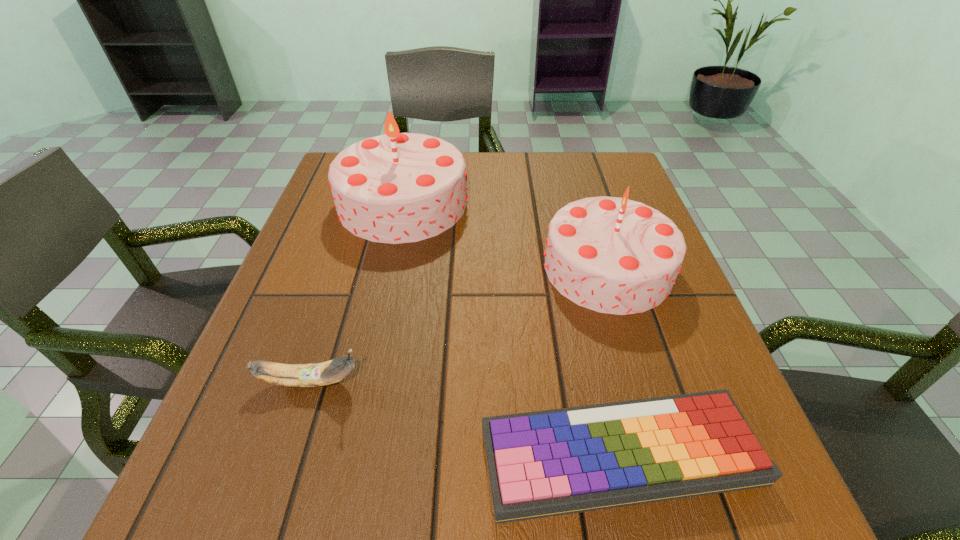
Locate an element on the screen. The image size is (960, 540). empty location between the shortest object and the second nearest object is located at coordinates (465, 418).

Find the location of a particular element. The height and width of the screenshot is (540, 960). free space that is in between the tallest object and the right birthday cake is located at coordinates (506, 235).

Where is `vacant space that is in between the third farthest object and the left birthday cake`? The width and height of the screenshot is (960, 540). vacant space that is in between the third farthest object and the left birthday cake is located at coordinates (357, 292).

Locate an element on the screen. The height and width of the screenshot is (540, 960). the closest object to the second nearest object is located at coordinates (546, 463).

Identify the location of object that can be found as the third closest to the banana. This screenshot has width=960, height=540. (613, 255).

Where is `free region that satisfies the following two spatial constraints: 1. on the back side of the shorter birthday cake; 2. on the left side of the computer keyboard`? This screenshot has width=960, height=540. free region that satisfies the following two spatial constraints: 1. on the back side of the shorter birthday cake; 2. on the left side of the computer keyboard is located at coordinates (576, 268).

In order to click on vacant point that satisfies the following two spatial constraints: 1. at the stem of the nearest object; 2. on the left side of the third farthest object in this screenshot , I will do `click(287, 455)`.